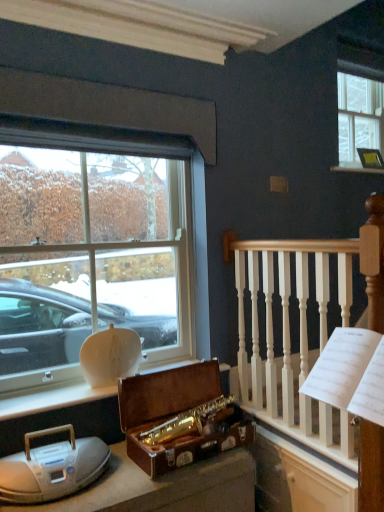
The width and height of the screenshot is (384, 512). In order to click on clear glass window at upper right, the second window from the front in this screenshot , I will do `click(359, 112)`.

Identify the location of clear glass window at upper left, which ranks as the 2th window in back-to-front order. The width and height of the screenshot is (384, 512). (92, 247).

What do you see at coordinates (370, 158) in the screenshot? I see `metallic gold picture frame at upper right` at bounding box center [370, 158].

What do you see at coordinates (52, 467) in the screenshot?
I see `white plastic radio at lower left` at bounding box center [52, 467].

Identify the location of white plastic radio at lower left. [x=52, y=467].

Image resolution: width=384 pixels, height=512 pixels. What are the coordinates of `clear glass window at upper right, which is the 2th window from bottom to top` in the screenshot? It's located at (359, 112).

Does clear glass window at upper left, placed as the first window when sorted from front to back, appear on the right side of metallic gold picture frame at upper right?

Incorrect, clear glass window at upper left, placed as the first window when sorted from front to back, is not on the right side of metallic gold picture frame at upper right.

Does clear glass window at upper left, which is the second window from right to left, lie in front of metallic gold picture frame at upper right?

Yes, clear glass window at upper left, which is the second window from right to left, is in front of metallic gold picture frame at upper right.

From the picture: What's the angular difference between clear glass window at upper left, which is the second window from right to left, and metallic gold picture frame at upper right's facing directions?

2.3 degrees separate the facing orientations of clear glass window at upper left, which is the second window from right to left, and metallic gold picture frame at upper right.

Could metallic gold picture frame at upper right be considered to be inside clear glass window at upper left, the 2th window viewed from the top?

Definitely not — metallic gold picture frame at upper right is not inside clear glass window at upper left, the 2th window viewed from the top.

Is white plastic radio at lower left taller than clear glass window at upper left, placed as the first window when sorted from front to back?

Incorrect, the height of white plastic radio at lower left is not larger of that of clear glass window at upper left, placed as the first window when sorted from front to back.

From the image's perspective, is white plastic radio at lower left over clear glass window at upper left, the 2th window viewed from the top?

No, from the image's perspective, white plastic radio at lower left is not over clear glass window at upper left, the 2th window viewed from the top.

Is the surface of white plastic radio at lower left in direct contact with clear glass window at upper left, the 2th window viewed from the top?

white plastic radio at lower left and clear glass window at upper left, the 2th window viewed from the top, are clearly separated.

From a real-world perspective, who is located higher, white plastic radio at lower left or clear glass window at upper left, which ranks as the 2th window in back-to-front order?

clear glass window at upper left, which ranks as the 2th window in back-to-front order, is physically above.

Considering the sizes of objects white plastic radio at lower left and white wood railing at upper right in the image provided, who is bigger, white plastic radio at lower left or white wood railing at upper right?

white wood railing at upper right is bigger.

From a real-world perspective, which is physically below, white plastic radio at lower left or white wood railing at upper right?

white plastic radio at lower left, from a real-world perspective.

Is there a large distance between white plastic radio at lower left and white wood railing at upper right?

Yes, white plastic radio at lower left and white wood railing at upper right are quite far apart.

Is clear glass window at upper right, the second window from the front, positioned before clear glass window at upper left, placed as the first window when sorted from front to back?

No, clear glass window at upper right, the second window from the front, is further to the viewer.

Is clear glass window at upper right, which appears as the first window when viewed from the back, directly adjacent to clear glass window at upper left, which ranks as the 2th window in back-to-front order?

clear glass window at upper right, which appears as the first window when viewed from the back, and clear glass window at upper left, which ranks as the 2th window in back-to-front order, are clearly separated.

From the image's perspective, is clear glass window at upper right, the second window from the front, positioned above or below clear glass window at upper left, positioned as the first window in bottom-to-top order?

From the image's perspective, clear glass window at upper right, the second window from the front, appears above clear glass window at upper left, positioned as the first window in bottom-to-top order.

Considering the positions of objects white plastic radio at lower left and metallic gold picture frame at upper right in the image provided, who is more to the right, white plastic radio at lower left or metallic gold picture frame at upper right?

metallic gold picture frame at upper right.

Where is `artifact directly beneath the metallic gold picture frame at upper right (from a real-world perspective)`? The image size is (384, 512). artifact directly beneath the metallic gold picture frame at upper right (from a real-world perspective) is located at coordinates (52, 467).

How much distance is there between white plastic radio at lower left and metallic gold picture frame at upper right?

white plastic radio at lower left is 9.37 feet from metallic gold picture frame at upper right.

Does point (64, 425) come farther from viewer compared to point (369, 168)?

No, (64, 425) is in front of (369, 168).

Does point (368, 154) come closer to viewer compared to point (148, 403)?

No, it is not.

Would you consider metallic gold picture frame at upper right to be distant from wooden suitcase at center?

Absolutely, metallic gold picture frame at upper right is distant from wooden suitcase at center.

In terms of size, does metallic gold picture frame at upper right appear bigger or smaller than wooden suitcase at center?

metallic gold picture frame at upper right is smaller than wooden suitcase at center.

Is the depth of metallic gold picture frame at upper right less than that of wooden suitcase at center?

No, metallic gold picture frame at upper right is further to the viewer.

In the image, is white plastic radio at lower left positioned in front of or behind wooden suitcase at center?

Clearly, white plastic radio at lower left is in front of wooden suitcase at center.

Can you confirm if white plastic radio at lower left is positioned to the left of wooden suitcase at center?

Yes, white plastic radio at lower left is to the left of wooden suitcase at center.

Locate an element on the screen. This screenshot has width=384, height=512. box positioned vertically above the white plastic radio at lower left (from a real-world perspective) is located at coordinates (176, 416).

Is white plastic radio at lower left taller than wooden suitcase at center?

No.

The image size is (384, 512). In order to click on window lying below the metallic gold picture frame at upper right (from the image's perspective) in this screenshot , I will do `click(92, 247)`.

From the image's perspective, starting from the white plastic radio at lower left, which window is the 1st one above? Please provide its 2D coordinates.

[(92, 247)]

Looking at the image, which one is located further to white wood railing at upper right, metallic gold picture frame at upper right or wooden suitcase at center?

The object further to white wood railing at upper right is metallic gold picture frame at upper right.

When comparing their distances from clear glass window at upper left, placed as the first window when sorted from front to back, does wooden suitcase at center or white wood railing at upper right seem closer?

The object closer to clear glass window at upper left, placed as the first window when sorted from front to back, is wooden suitcase at center.

Considering their positions, is white plastic radio at lower left positioned closer to white wood railing at upper right than clear glass window at upper right, which is the 2th window from bottom to top?

white plastic radio at lower left is closer to white wood railing at upper right.

From the image, which object appears to be farther from wooden suitcase at center, clear glass window at upper right, which is the 1th window from right to left, or metallic gold picture frame at upper right?

clear glass window at upper right, which is the 1th window from right to left, is further to wooden suitcase at center.

When comparing their distances from wooden suitcase at center, does metallic gold picture frame at upper right or white wood railing at upper right seem further?

Based on the image, metallic gold picture frame at upper right appears to be further to wooden suitcase at center.

Looking at this image, based on their spatial positions, is white plastic radio at lower left or clear glass window at upper left, which is the second window from right to left, further from wooden suitcase at center?

clear glass window at upper left, which is the second window from right to left.

Looking at the image, which one is located further to white plastic radio at lower left, wooden suitcase at center or white wood railing at upper right?

Among the two, white wood railing at upper right is located further to white plastic radio at lower left.

Considering their positions, is white plastic radio at lower left positioned closer to clear glass window at upper left, the 2th window viewed from the top, than clear glass window at upper right, which is the 2th window from bottom to top?

The object closer to clear glass window at upper left, the 2th window viewed from the top, is white plastic radio at lower left.

Identify the location of rail between clear glass window at upper right, the second window from the front, and white plastic radio at lower left vertically. (302, 301).

Locate an element on the screen. The height and width of the screenshot is (512, 384). window between white plastic radio at lower left and metallic gold picture frame at upper right is located at coordinates (92, 247).

This screenshot has height=512, width=384. What are the coordinates of `rail between clear glass window at upper left, which is the second window from right to left, and metallic gold picture frame at upper right, in the horizontal direction` in the screenshot? It's located at (302, 301).

This screenshot has width=384, height=512. Identify the location of rail between white plastic radio at lower left and metallic gold picture frame at upper right in the horizontal direction. (302, 301).